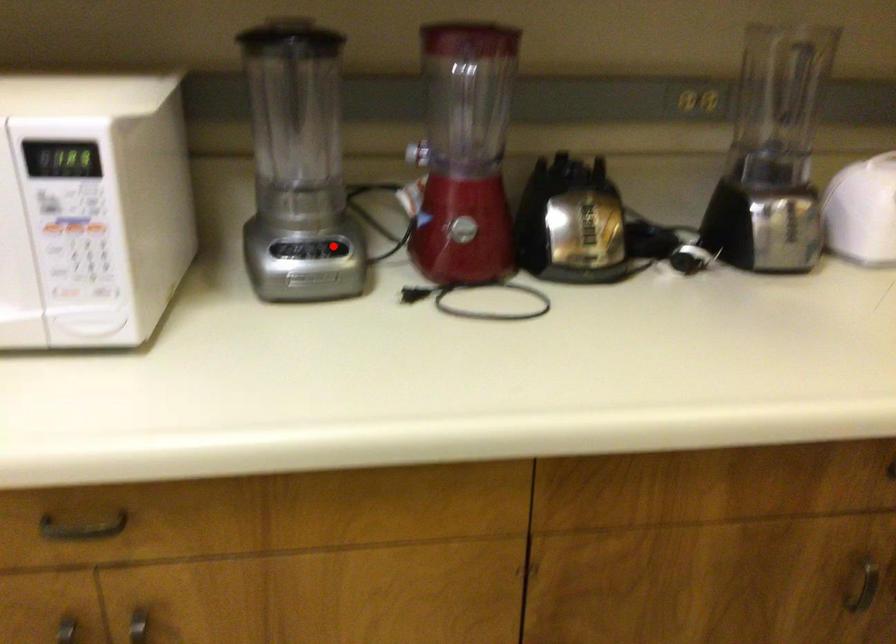
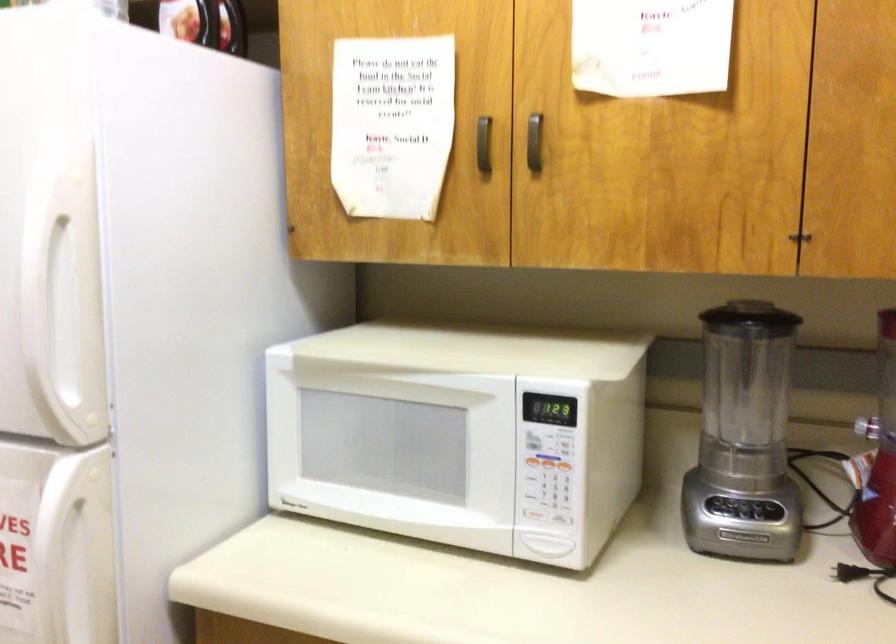
In the second image, find the point that corresponds to the highlighted location in the first image.

(771, 509)